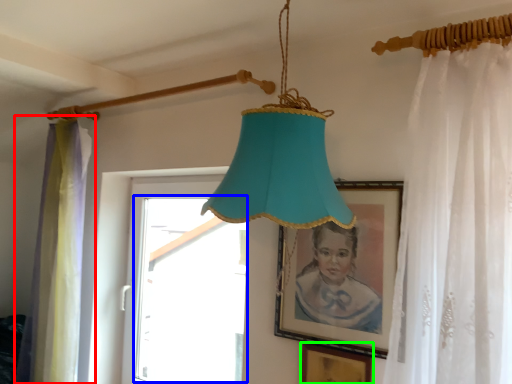
Question: Estimate the real-world distances between objects in this image. Which object is closer to curtain (highlighted by a red box), window (highlighted by a blue box) or picture frame (highlighted by a green box)?

Choices:
 (A) window
 (B) picture frame

Answer: (A)